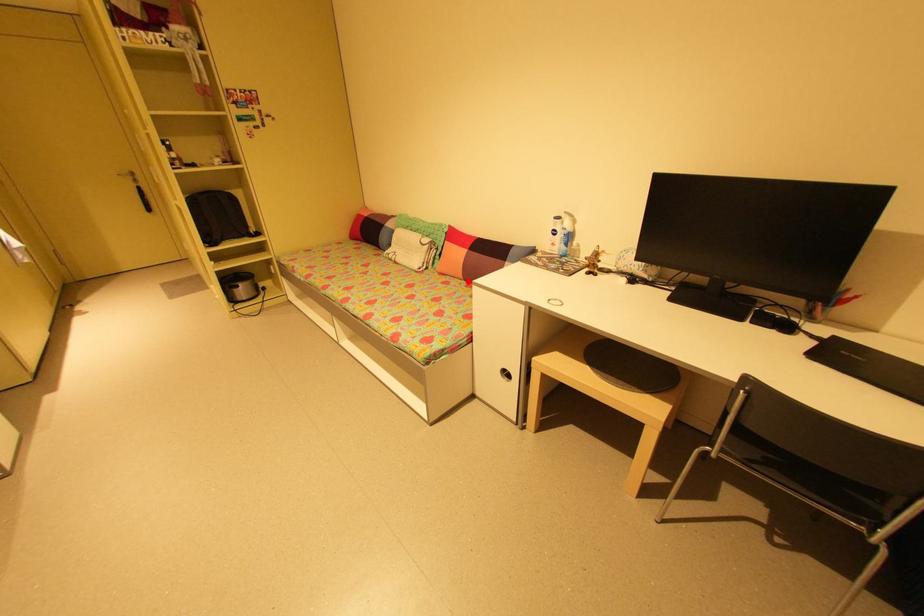
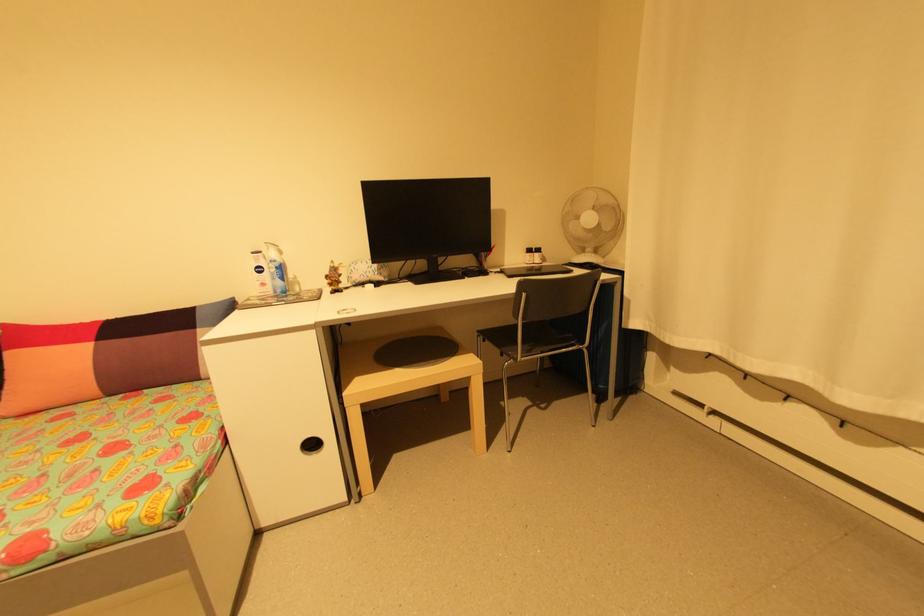
In the second image, find the point that corresponds to the highlighted location in the first image.

(111, 399)